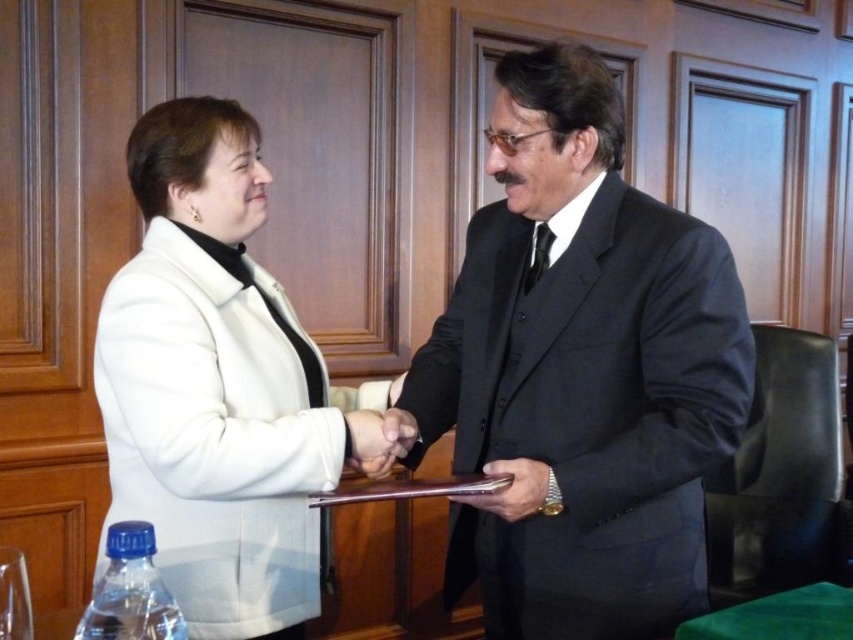
You are a photographer positioned to the right of the scene. You want to capture a closeup of the white woolen coat at center without including the smooth skin handshake at center in the frame. Which direction should you move to achieve this?

The white woolen coat at center is to the left of the smooth skin handshake at center. To avoid including the handshake in the frame, you should move to the right side of the scene so that the coat remains in view while the handshake moves out of the frame.

Based on the photo, you are a security guard in the conference room. You see the white woolen coat at center and the leather wallet at center. Which item is covering the other one?

The white woolen coat at center is positioned over the leather wallet at center, so the coat is covering the wallet.

You are a photographer preparing to take a group photo in the scene. You need to arrange the black satin suit at center and the white woolen coat at center so that both are fully visible in the frame. Which clothing item should be placed closer to the camera to ensure both are visible?

The black satin suit at center is much taller than the white woolen coat at center. To ensure both are fully visible in the frame, the shorter white woolen coat at center should be placed closer to the camera so that the taller black satin suit at center doesn